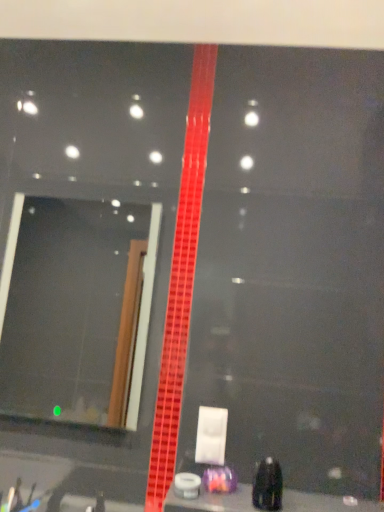
Question: Considering the relative sizes of black plastic bottle at lower right, which is the first toiletry in right-to-left order, and matte glass mirror at left in the image provided, is black plastic bottle at lower right, which is the first toiletry in right-to-left order, wider than matte glass mirror at left?

Choices:
 (A) yes
 (B) no

Answer: (A)

Question: Is matte glass mirror at left at the back of black plastic bottle at lower right, which is the first toiletry in right-to-left order?

Choices:
 (A) no
 (B) yes

Answer: (A)

Question: Considering the relative positions of black plastic bottle at lower right, which appears as the second toiletry when viewed from the back, and matte glass mirror at left in the image provided, is black plastic bottle at lower right, which appears as the second toiletry when viewed from the back, to the right of matte glass mirror at left from the viewer's perspective?

Choices:
 (A) yes
 (B) no

Answer: (A)

Question: Considering the relative sizes of black plastic bottle at lower right, which appears as the second toiletry when viewed from the back, and matte glass mirror at left in the image provided, is black plastic bottle at lower right, which appears as the second toiletry when viewed from the back, smaller than matte glass mirror at left?

Choices:
 (A) yes
 (B) no

Answer: (A)

Question: Does black plastic bottle at lower right, which appears as the second toiletry when viewed from the back, come in front of matte glass mirror at left?

Choices:
 (A) no
 (B) yes

Answer: (B)

Question: From the image's perspective, is matte glass mirror at left located above or below translucent purple container at center, which is the first toiletry from left to right?

Choices:
 (A) below
 (B) above

Answer: (B)

Question: In the image, is matte glass mirror at left on the left side or the right side of translucent purple container at center, which is the 1th toiletry from back to front?

Choices:
 (A) right
 (B) left

Answer: (B)

Question: Based on their sizes in the image, would you say matte glass mirror at left is bigger or smaller than translucent purple container at center, acting as the 2th toiletry starting from the right?

Choices:
 (A) small
 (B) big

Answer: (B)

Question: From their relative heights in the image, would you say matte glass mirror at left is taller or shorter than translucent purple container at center, which is the first toiletry from left to right?

Choices:
 (A) tall
 (B) short

Answer: (A)

Question: In the image, is smooth black surface at bottom on the left side or the right side of matte glass mirror at left?

Choices:
 (A) left
 (B) right

Answer: (B)

Question: From their relative heights in the image, would you say smooth black surface at bottom is taller or shorter than matte glass mirror at left?

Choices:
 (A) short
 (B) tall

Answer: (A)

Question: Considering the positions of point (360, 501) and point (77, 312), is point (360, 501) closer or farther from the camera than point (77, 312)?

Choices:
 (A) farther
 (B) closer

Answer: (B)

Question: From a real-world perspective, is smooth black surface at bottom physically located above or below matte glass mirror at left?

Choices:
 (A) below
 (B) above

Answer: (A)

Question: Is point (329, 506) closer or farther from the camera than point (261, 488)?

Choices:
 (A) closer
 (B) farther

Answer: (B)

Question: Considering the positions of smooth black surface at bottom and black plastic bottle at lower right, positioned as the 1th toiletry in front-to-back order, in the image, is smooth black surface at bottom bigger or smaller than black plastic bottle at lower right, positioned as the 1th toiletry in front-to-back order,?

Choices:
 (A) big
 (B) small

Answer: (A)